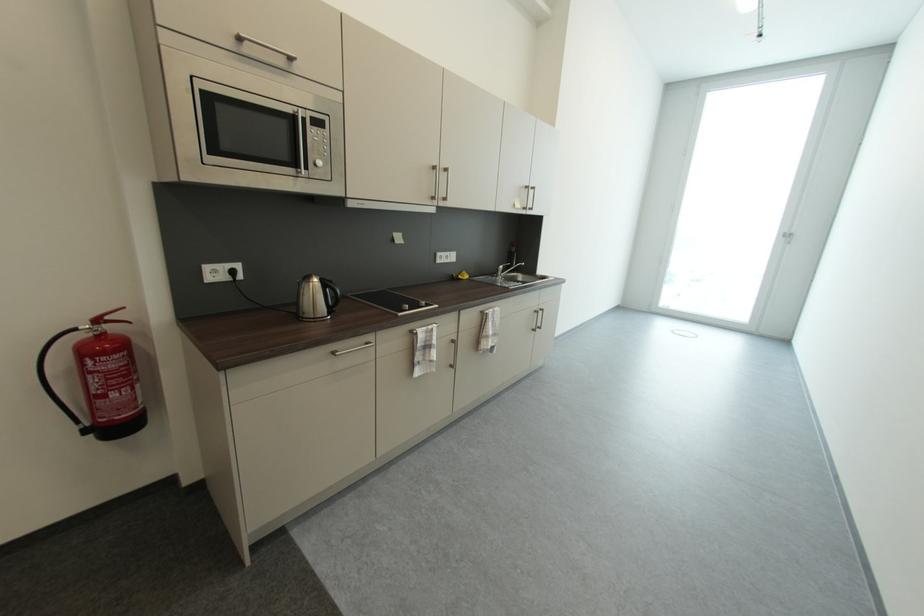
The height and width of the screenshot is (616, 924). Identify the location of white door handle. (795, 237).